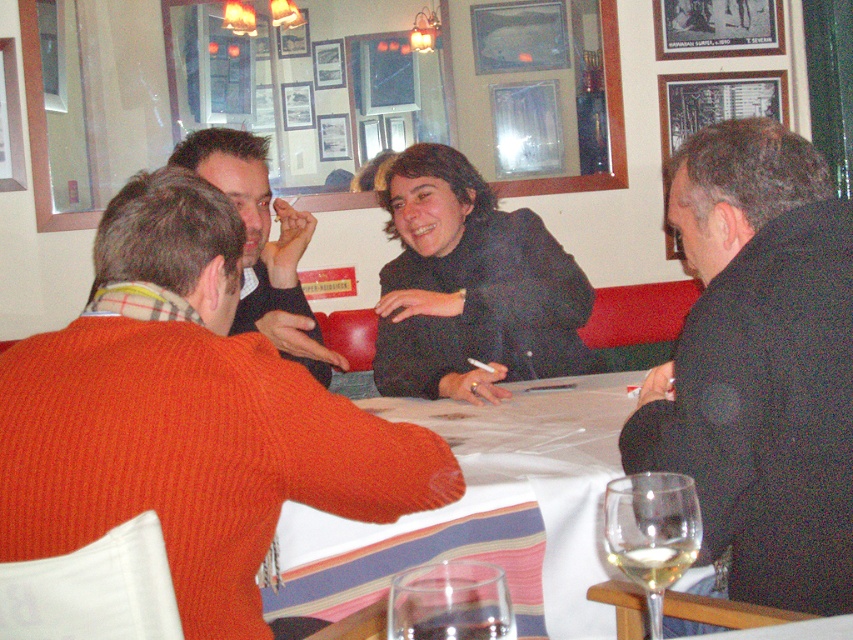
Can you confirm if black matte jacket at center is positioned to the left of clear glass wine glass at lower right?

Yes, black matte jacket at center is to the left of clear glass wine glass at lower right.

What do you see at coordinates (469, 285) in the screenshot? I see `black matte jacket at center` at bounding box center [469, 285].

Does point (450, 300) come behind point (622, 566)?

That is True.

Identify the location of black matte jacket at center. (469, 285).

Is white cloth at center in front of orange knit sweater at left?

Yes, it is.

Is point (386, 582) closer to viewer compared to point (276, 276)?

That is True.

Is point (494, 420) in front of point (263, 300)?

Yes.

This screenshot has height=640, width=853. What are the coordinates of `white cloth at center` in the screenshot? It's located at (480, 508).

Can you confirm if clear glass wine at lower right is positioned to the left of clear glass at lower center?

In fact, clear glass wine at lower right is to the right of clear glass at lower center.

Between clear glass wine at lower right and clear glass at lower center, which one has more height?

clear glass wine at lower right

Between point (643, 552) and point (412, 621), which one is positioned behind?

The point (643, 552) is behind.

At what (x,y) coordinates should I click in order to perform the action: click on clear glass wine at lower right. Please return your answer as a coordinate pair (x, y). Looking at the image, I should click on (653, 561).